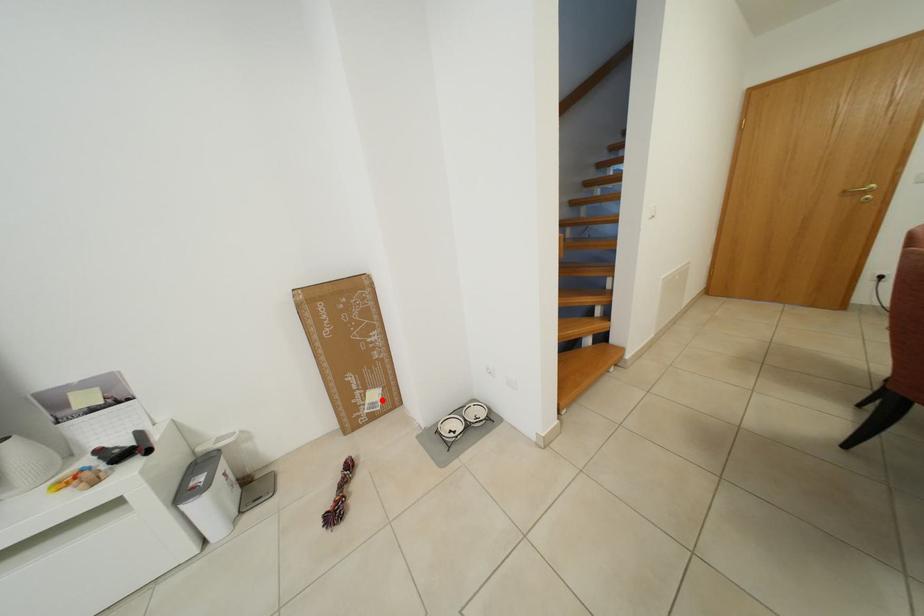
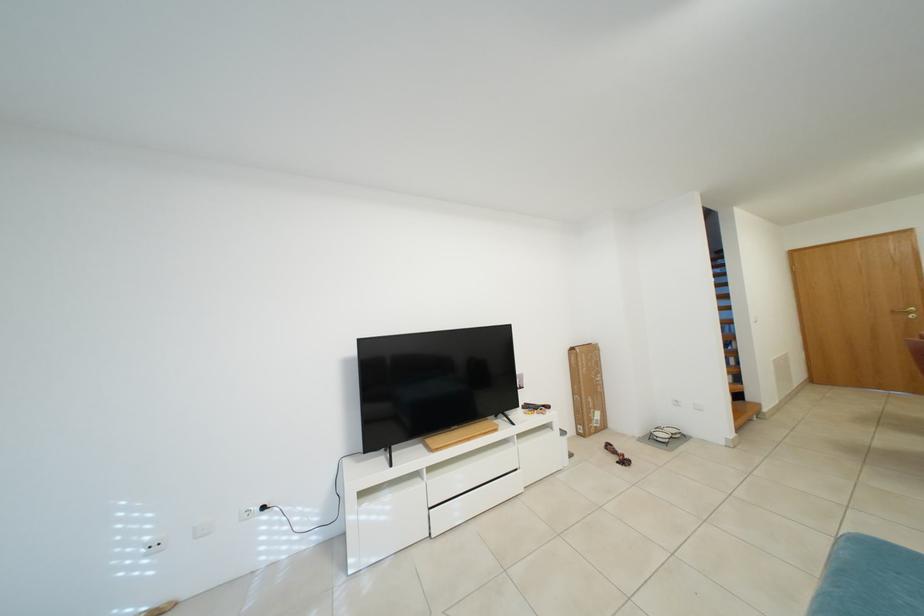
Find the pixel in the second image that matches the highlighted location in the first image.

(605, 419)